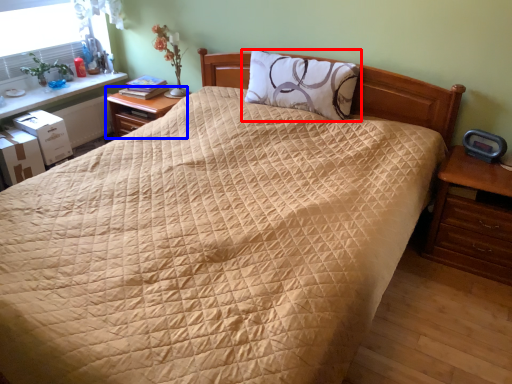
Question: Which point is closer to the camera, pillow (highlighted by a red box) or nightstand (highlighted by a blue box)?

Choices:
 (A) pillow
 (B) nightstand

Answer: (A)